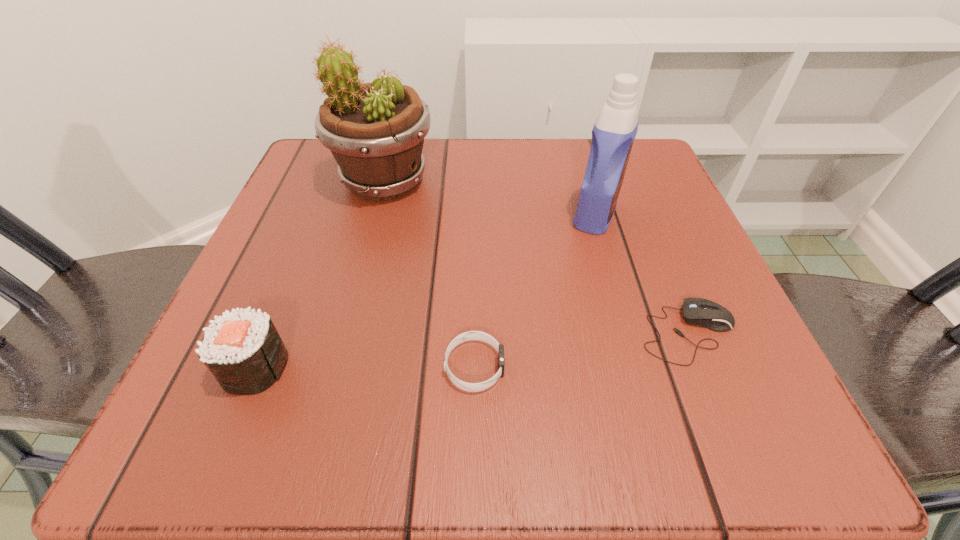
I want to click on vacant space that satisfies the following two spatial constraints: 1. on the back side of the sushi; 2. on the left side of the detergent, so click(x=318, y=214).